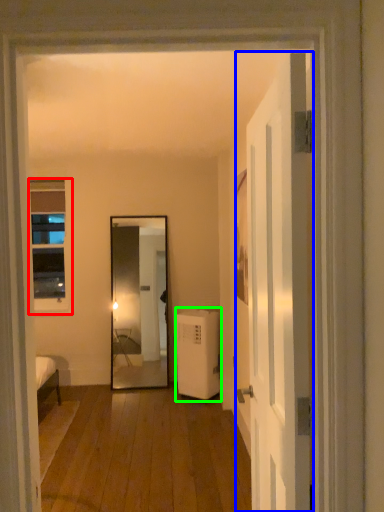
Question: Which object is the farthest from window (highlighted by a red box)? Choose among these: door (highlighted by a blue box) or air conditioner (highlighted by a green box).

Choices:
 (A) door
 (B) air conditioner

Answer: (A)